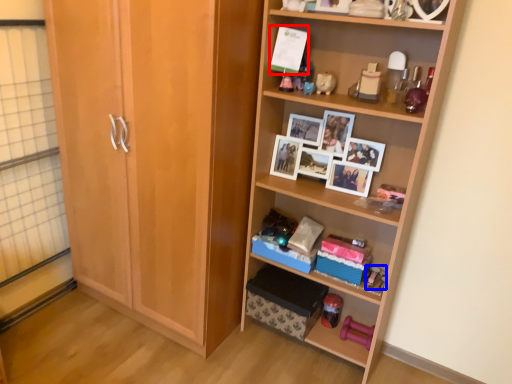
Question: Which object appears closest to the camera in this image, postcard (highlighted by a red box) or toy (highlighted by a blue box)?

Choices:
 (A) postcard
 (B) toy

Answer: (A)